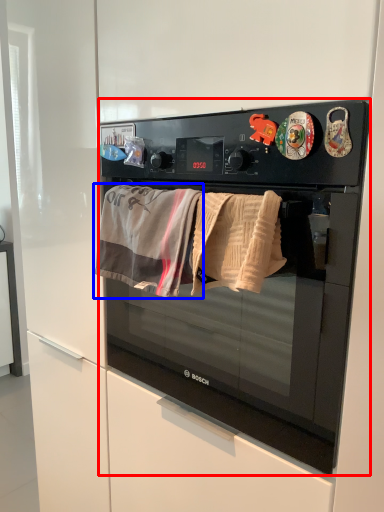
Question: Which object is further to the camera taking this photo, microwave oven (highlighted by a red box) or beach towel (highlighted by a blue box)?

Choices:
 (A) microwave oven
 (B) beach towel

Answer: (B)